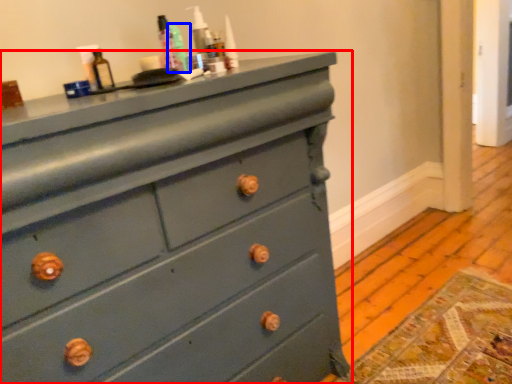
Question: Which point is closer to the camera, chest of drawers (highlighted by a red box) or teal (highlighted by a blue box)?

Choices:
 (A) chest of drawers
 (B) teal

Answer: (A)